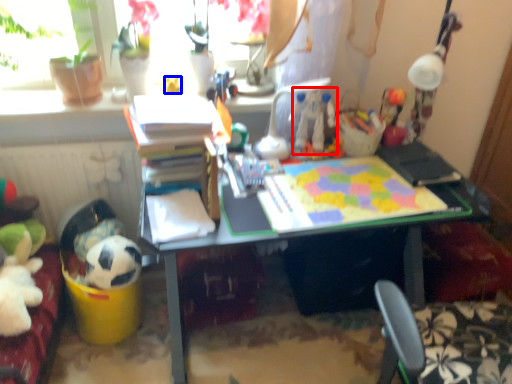
Question: Among these objects, which one is nearest to the camera, toy (highlighted by a red box) or toy (highlighted by a blue box)?

Choices:
 (A) toy
 (B) toy

Answer: (A)